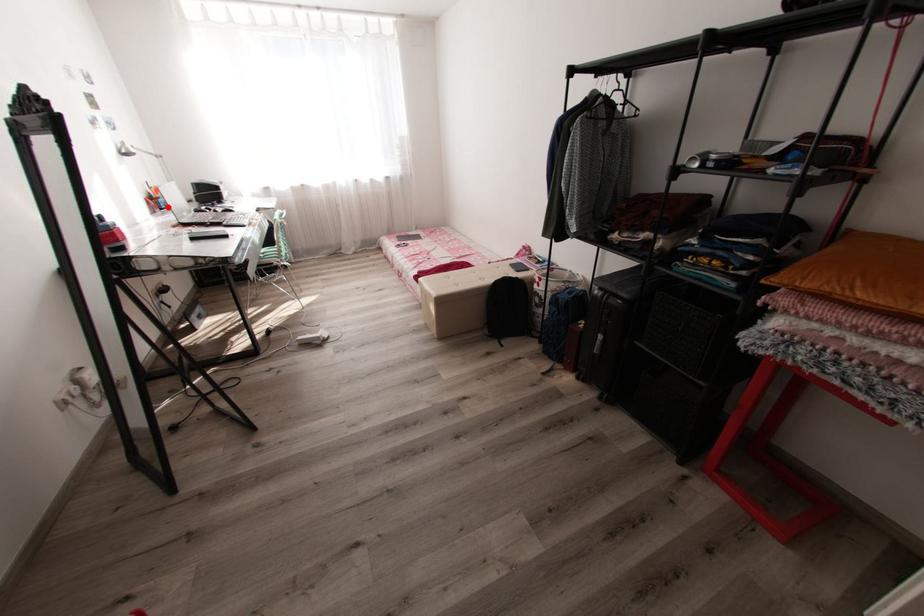
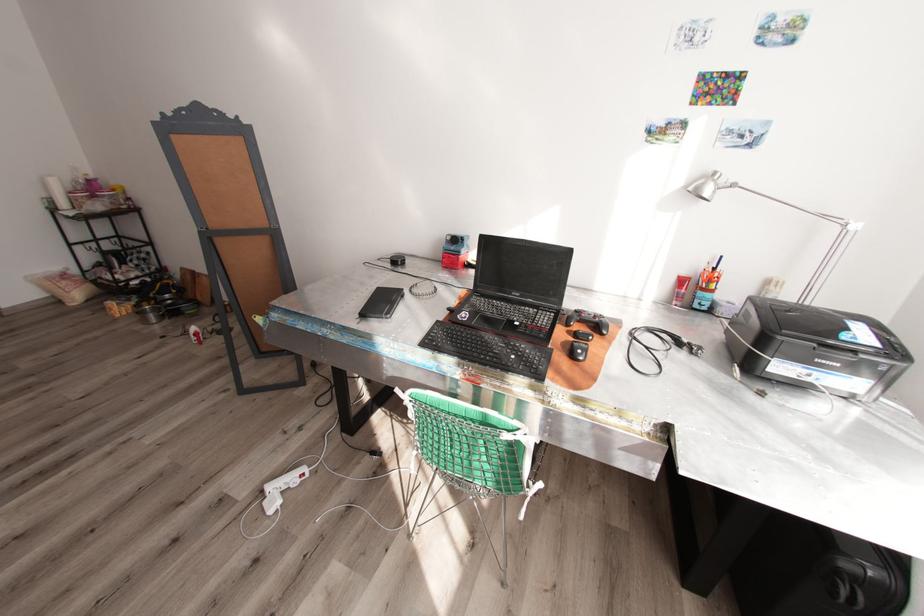
Where in the second image is the point corresponding to the highlighted location from the first image?

(699, 305)